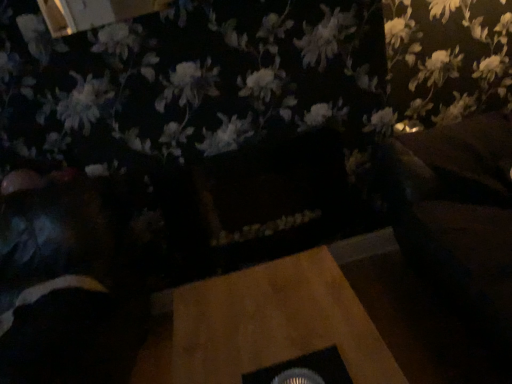
Where is `empty space that is ontop of wooden textured round table at center (from a real-world perspective)`? empty space that is ontop of wooden textured round table at center (from a real-world perspective) is located at coordinates (274, 319).